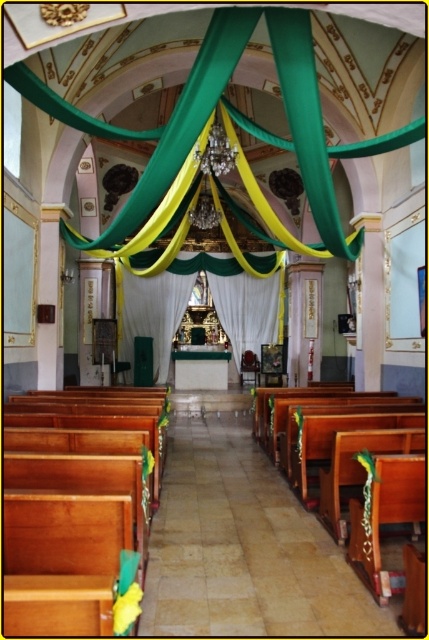
Based on the photo, measure the distance between wooden pews at center and white fabric curtain at center.

The distance of wooden pews at center from white fabric curtain at center is 11.98 meters.

This screenshot has width=429, height=640. Find the location of `wooden pews at center`. wooden pews at center is located at coordinates (242, 547).

Is wooden pews at center closer to the viewer compared to white sheer curtain at center?

Yes.

Is wooden pews at center bigger than white sheer curtain at center?

Actually, wooden pews at center might be smaller than white sheer curtain at center.

Does point (245, 452) lie in front of point (129, 333)?

Yes, point (245, 452) is closer to viewer.

Locate an element on the screen. This screenshot has width=429, height=640. wooden pews at center is located at coordinates (242, 547).

Who is more forward, (151, 296) or (256, 294)?

Point (151, 296)

Can you confirm if white sheer curtain at center is wider than white fabric curtain at center?

Incorrect, white sheer curtain at center's width does not surpass white fabric curtain at center's.

Find the location of a particular element. white sheer curtain at center is located at coordinates (154, 314).